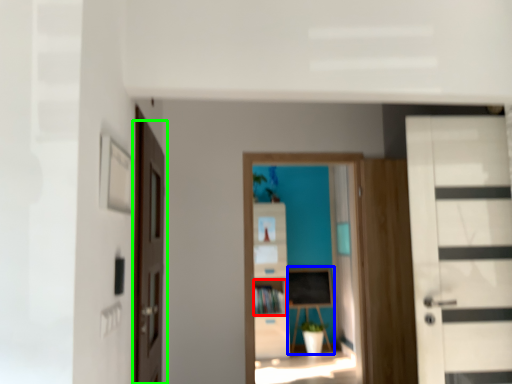
Question: Which is nearer to the cabinet (highlighted by a red box)? table (highlighted by a blue box) or door (highlighted by a green box).

Choices:
 (A) table
 (B) door

Answer: (A)